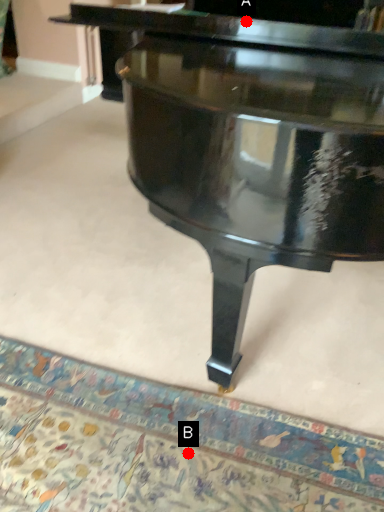
Question: Two points are circled on the image, labeled by A and B beside each circle. Which of the following is the closest to the observer?

Choices:
 (A) A is closer
 (B) B is closer

Answer: (B)